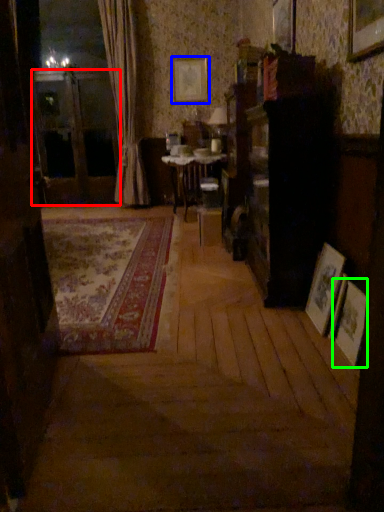
Question: Which object is the closest to the screen door (highlighted by a red box)? Choose among these: picture frame (highlighted by a blue box) or picture frame (highlighted by a green box).

Choices:
 (A) picture frame
 (B) picture frame

Answer: (A)